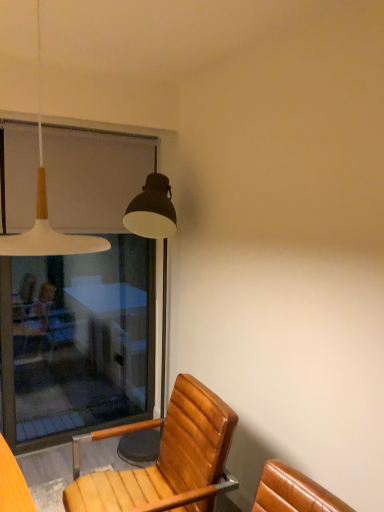
Identify the location of transparent glass screen door at left. (76, 341).

This screenshot has height=512, width=384. What do you see at coordinates (47, 210) in the screenshot? I see `white matte pendant light at upper left` at bounding box center [47, 210].

This screenshot has width=384, height=512. Find the location of `wooden chair at lower center`. wooden chair at lower center is located at coordinates (166, 460).

Is white matte pendant light at upper left spatially inside wooden chair at lower center, or outside of it?

The correct answer is: outside.

Who is shorter, white matte pendant light at upper left or wooden chair at lower center?

Standing shorter between the two is white matte pendant light at upper left.

Is white matte pendant light at upper left to the left or to the right of wooden chair at lower center in the image?

In the image, white matte pendant light at upper left appears on the left side of wooden chair at lower center.

At what (x,y) coordinates should I click in order to perform the action: click on screen door below the white matte pendant light at upper left (from a real-world perspective). Please return your answer as a coordinate pair (x, y). Looking at the image, I should click on (76, 341).

Considering the sizes of objects transparent glass screen door at left and white matte pendant light at upper left in the image provided, who is wider, transparent glass screen door at left or white matte pendant light at upper left?

white matte pendant light at upper left.

From the image's perspective, is transparent glass screen door at left above or below white matte pendant light at upper left?

transparent glass screen door at left is situated lower than white matte pendant light at upper left in the image.

Is transparent glass screen door at left positioned with its back to white matte pendant light at upper left?

No, transparent glass screen door at left's orientation is not away from white matte pendant light at upper left.

Considering the relative positions of wooden chair at lower center and white matte pendant light at upper left in the image provided, is wooden chair at lower center behind white matte pendant light at upper left?

Yes, it is behind white matte pendant light at upper left.

From the image's perspective, would you say wooden chair at lower center is shown under white matte pendant light at upper left?

Yes, from the image's perspective, wooden chair at lower center is beneath white matte pendant light at upper left.

Is wooden chair at lower center next to white matte pendant light at upper left?

There is a gap between wooden chair at lower center and white matte pendant light at upper left.

Which point is more distant from viewer, [180,465] or [39,26]?

The point [39,26] is more distant.

Is wooden chair at lower center next to transparent glass screen door at left and touching it?

wooden chair at lower center and transparent glass screen door at left are clearly separated.

From the image's perspective, which object appears higher, wooden chair at lower center or transparent glass screen door at left?

transparent glass screen door at left is shown above in the image.

From a real-world perspective, relative to transparent glass screen door at left, is wooden chair at lower center vertically above or below?

From a real-world perspective, wooden chair at lower center is physically below transparent glass screen door at left.

Does wooden chair at lower center have a smaller size compared to transparent glass screen door at left?

Incorrect, wooden chair at lower center is not smaller in size than transparent glass screen door at left.

Measure the distance between transparent glass screen door at left and wooden chair at lower center.

transparent glass screen door at left is 5.55 feet away from wooden chair at lower center.

From a real-world perspective, is transparent glass screen door at left physically above wooden chair at lower center?

Yes.

Considering the sizes of objects transparent glass screen door at left and wooden chair at lower center in the image provided, who is thinner, transparent glass screen door at left or wooden chair at lower center?

transparent glass screen door at left.

Based on the photo, is wooden chair at lower center inside transparent glass screen door at left?

No, wooden chair at lower center is not a part of transparent glass screen door at left.

Between white matte pendant light at upper left and transparent glass screen door at left, which one appears on the right side from the viewer's perspective?

Positioned to the right is white matte pendant light at upper left.

Based on the photo, considering the sizes of white matte pendant light at upper left and transparent glass screen door at left in the image, is white matte pendant light at upper left bigger or smaller than transparent glass screen door at left?

Clearly, white matte pendant light at upper left is smaller in size than transparent glass screen door at left.

Is transparent glass screen door at left at the back of white matte pendant light at upper left?

white matte pendant light at upper left is not turned away from transparent glass screen door at left.

Choose the correct answer: Is white matte pendant light at upper left inside transparent glass screen door at left or outside it?

white matte pendant light at upper left is located beyond the bounds of transparent glass screen door at left.

At what (x,y) coordinates should I click in order to perform the action: click on chair located underneath the white matte pendant light at upper left (from a real-world perspective). Please return your answer as a coordinate pair (x, y). This screenshot has width=384, height=512. Looking at the image, I should click on (166, 460).

This screenshot has height=512, width=384. What are the coordinates of `lamp located above the transparent glass screen door at left (from the image's perspective)` in the screenshot? It's located at (47, 210).

Looking at the image, which one is located further to wooden chair at lower center, white matte pendant light at upper left or transparent glass screen door at left?

transparent glass screen door at left.

Looking at the image, which one is located closer to wooden chair at lower center, transparent glass screen door at left or white matte pendant light at upper left?

Based on the image, white matte pendant light at upper left appears to be nearer to wooden chair at lower center.

Looking at the image, which one is located closer to transparent glass screen door at left, wooden chair at lower center or white matte pendant light at upper left?

Based on the image, wooden chair at lower center appears to be nearer to transparent glass screen door at left.

Which object lies further to the anchor point white matte pendant light at upper left, transparent glass screen door at left or wooden chair at lower center?

transparent glass screen door at left lies further to white matte pendant light at upper left than the other object.

From the image, which object appears to be nearer to white matte pendant light at upper left, wooden chair at lower center or transparent glass screen door at left?

The object closer to white matte pendant light at upper left is wooden chair at lower center.

Looking at the image, which one is located closer to transparent glass screen door at left, white matte pendant light at upper left or wooden chair at lower center?

Among the two, wooden chair at lower center is located nearer to transparent glass screen door at left.

This screenshot has width=384, height=512. I want to click on chair between white matte pendant light at upper left and transparent glass screen door at left from front to back, so click(x=166, y=460).